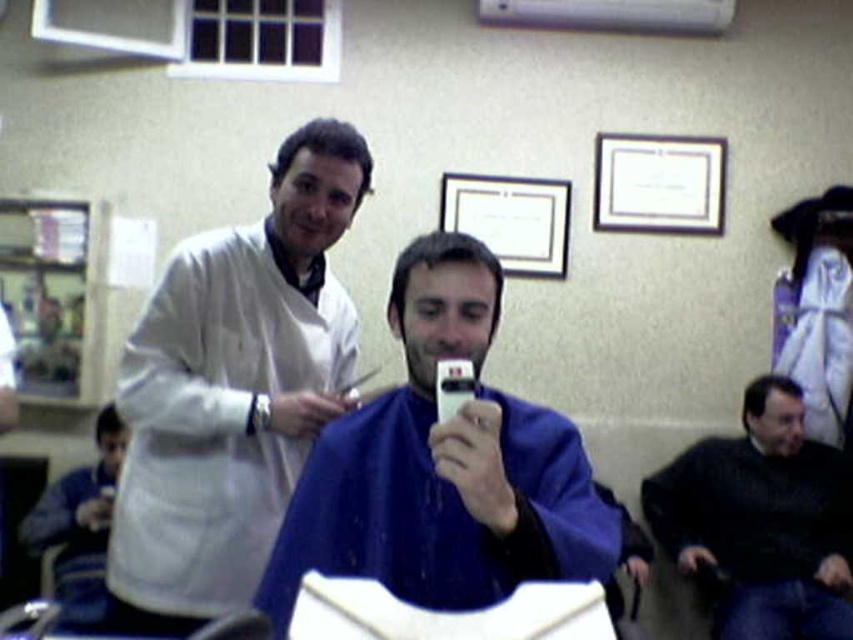
Question: Is blue fabric at lower left below smooth white hair at upper left?

Choices:
 (A) yes
 (B) no

Answer: (A)

Question: Which object appears closest to the camera in this image?

Choices:
 (A) white matte lab coat at upper left
 (B) smooth white hair at upper left

Answer: (A)

Question: Can you confirm if blue fabric cape at center is positioned to the right of dark brown hair at lower right?

Choices:
 (A) no
 (B) yes

Answer: (A)

Question: Which object appears closest to the camera in this image?

Choices:
 (A) black matte jacket at lower right
 (B) dark brown hair at lower right
 (C) smooth dark hair at center
 (D) blue fabric at lower left

Answer: (C)

Question: Which point is closer to the camera?

Choices:
 (A) white matte lab coat at upper left
 (B) smooth dark hair at center
 (C) blue fabric cape at center
 (D) blue fabric at lower left

Answer: (C)

Question: Is black matte jacket at lower right wider than smooth white hair at upper left?

Choices:
 (A) yes
 (B) no

Answer: (A)